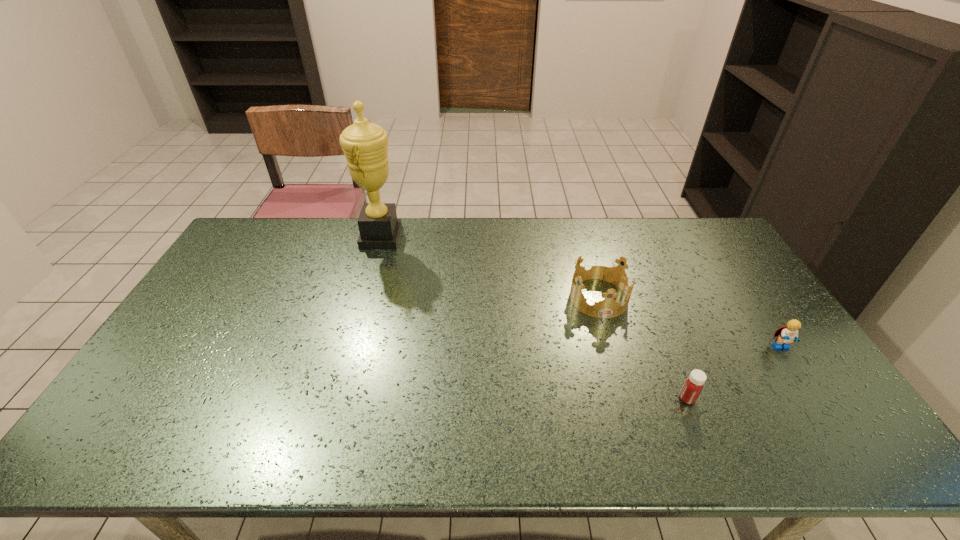
Identify the location of free space that satisfies the following two spatial constraints: 1. at the front of the leftmost object with handles; 2. on the left side of the medicine. This screenshot has width=960, height=540. (335, 399).

You are a GUI agent. You are given a task and a screenshot of the screen. Output one action in this format:
    pyautogui.click(x=<x>, y=<y>)
    Task: Click on the free location that satisfies the following two spatial constraints: 1. on the front-facing side of the third object from right to left; 2. on the left side of the medicine
    
    Given the screenshot: What is the action you would take?
    pyautogui.click(x=628, y=399)

The height and width of the screenshot is (540, 960). Identify the location of vacant space that satisfies the following two spatial constraints: 1. on the front-facing side of the tiara; 2. on the left side of the nearest object. (628, 399).

This screenshot has height=540, width=960. Find the location of `vacant region that satisfies the following two spatial constraints: 1. at the front of the second object from right to left with handles; 2. on the left side of the leftmost object`. vacant region that satisfies the following two spatial constraints: 1. at the front of the second object from right to left with handles; 2. on the left side of the leftmost object is located at coordinates (335, 399).